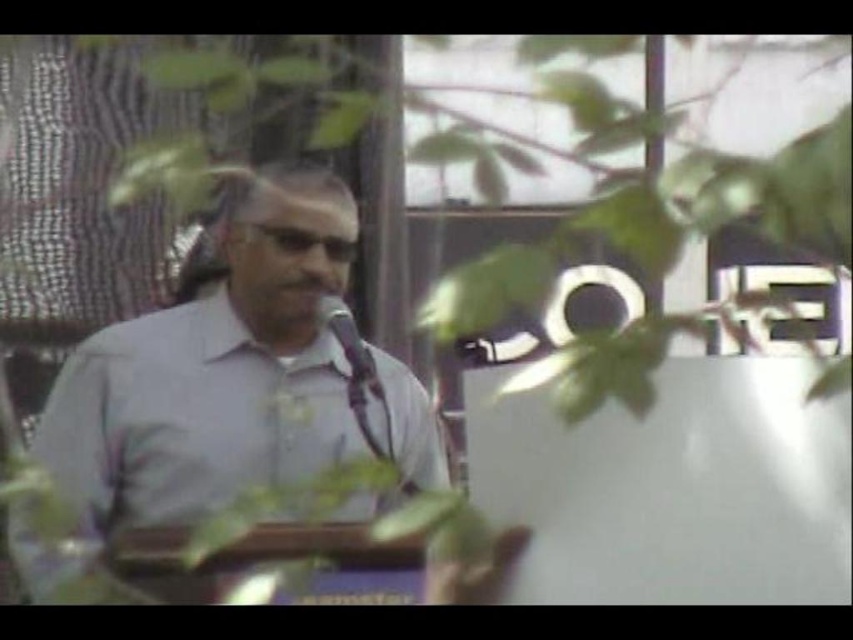
You are a photographer adjusting your camera settings to focus on the metallic silver microphone at center. Given that the gray matte shirt at center is closer to you than the microphone, will the microphone be in focus if you focus on the shirt?

The gray matte shirt at center is closer to the viewer than the metallic silver microphone at center. If you focus on the shirt, the microphone will likely be out of focus because it is further away from the focused plane.

You are standing in front of the podium and want to place a small decoration between the two points labeled point (x=76, y=440) and point (x=364, y=385). Which point should you start placing the decoration closer to to ensure it is nearer to the speaker?

You should start placing the decoration closer to point (x=76, y=440) because it is closer to the viewer than point (x=364, y=385), making it nearer to the speaker.

Looking at this image, you are a photographer adjusting the focus on your camera. You need to ensure that the gray matte shirt at center is in focus. Given that the point at coordinates point [207,378] is the center of the gray matte shirt at center, where should you focus your camera?

You should focus your camera at the point marked by the coordinates point [207,378], which is the center of the gray matte shirt at center.